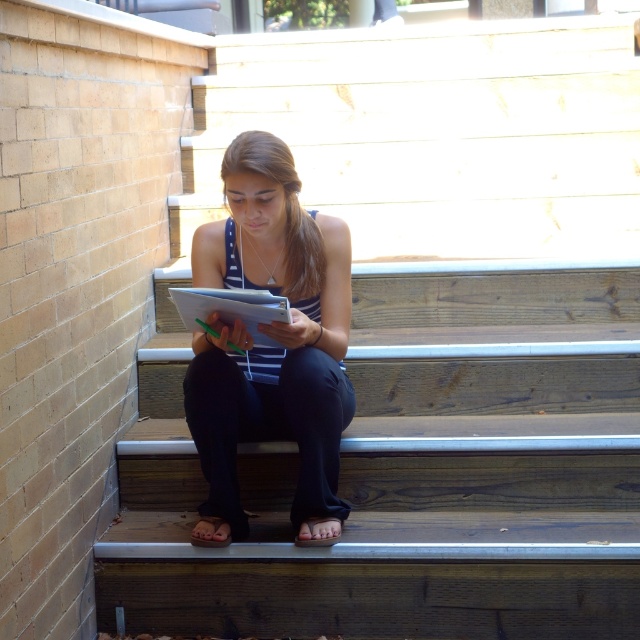
Based on the photo, can you confirm if matte black notebook at center is positioned to the left of white paper at center?

Incorrect, matte black notebook at center is not on the left side of white paper at center.

In order to click on matte black notebook at center in this screenshot , I will do `click(272, 348)`.

I want to click on matte black notebook at center, so click(x=272, y=348).